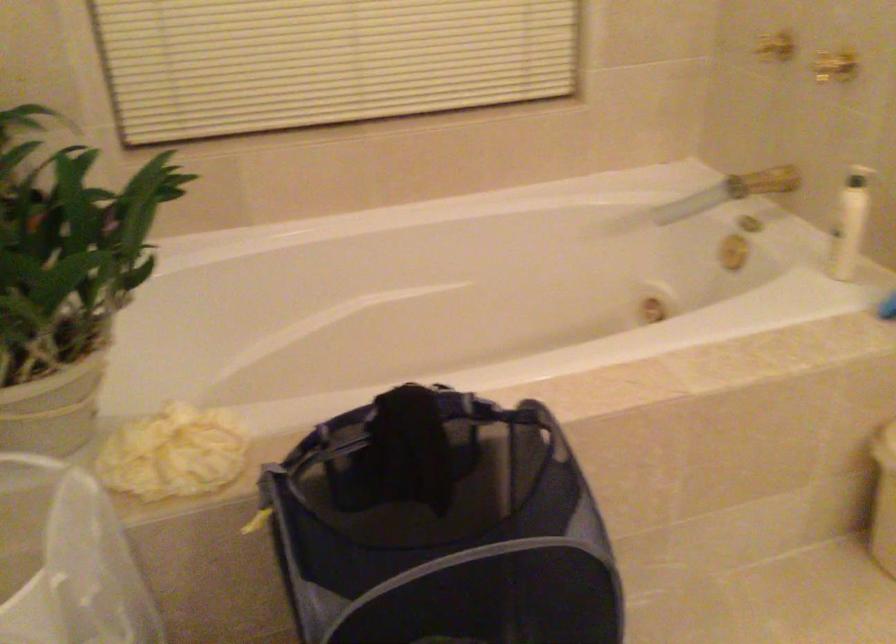
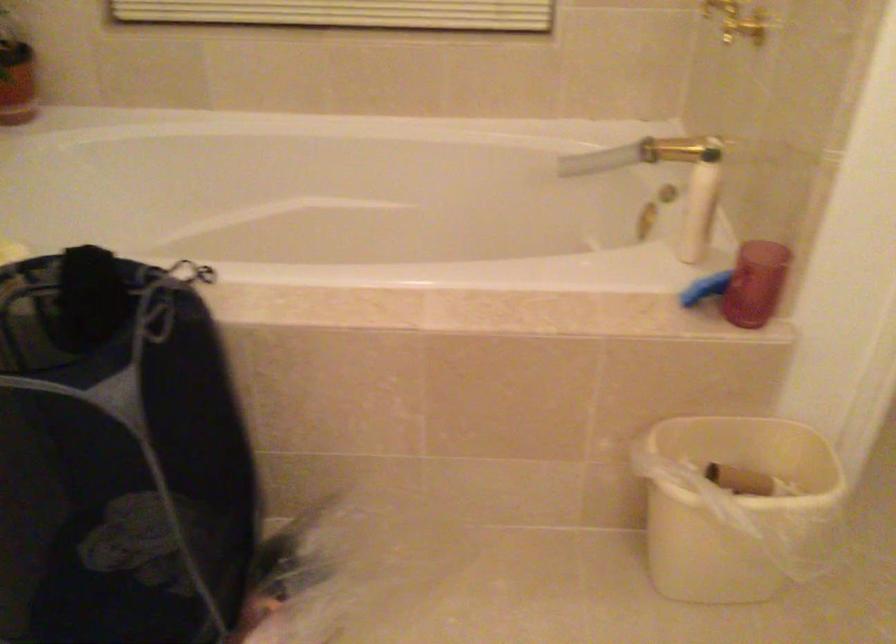
Question: In a continuous first-person perspective shot, in which direction is the camera moving?

Choices:
 (A) Left
 (B) Right
 (C) Forward
 (D) Backward

Answer: (B)